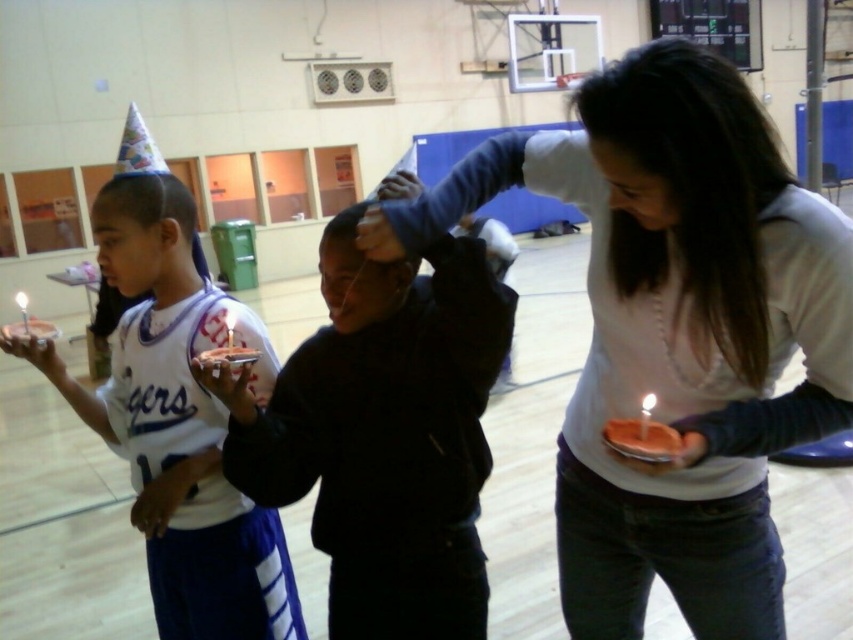
Does matte white shirt at center appear on the left side of white jersey at center?

Incorrect, matte white shirt at center is not on the left side of white jersey at center.

Which is above, matte white shirt at center or white jersey at center?

matte white shirt at center

Identify the location of matte white shirt at center. The image size is (853, 640). (674, 332).

Does point (804, 230) come farther from viewer compared to point (477, 481)?

No, (804, 230) is in front of (477, 481).

Does matte white shirt at center have a lesser width compared to black matte jacket at center?

Incorrect, matte white shirt at center's width is not less than black matte jacket at center's.

Locate an element on the screen. matte white shirt at center is located at coordinates (674, 332).

Find the location of a particular element. The width and height of the screenshot is (853, 640). matte white shirt at center is located at coordinates (674, 332).

Which is more to the left, black matte jacket at center or white jersey at center?

Positioned to the left is white jersey at center.

Image resolution: width=853 pixels, height=640 pixels. I want to click on black matte jacket at center, so click(x=384, y=435).